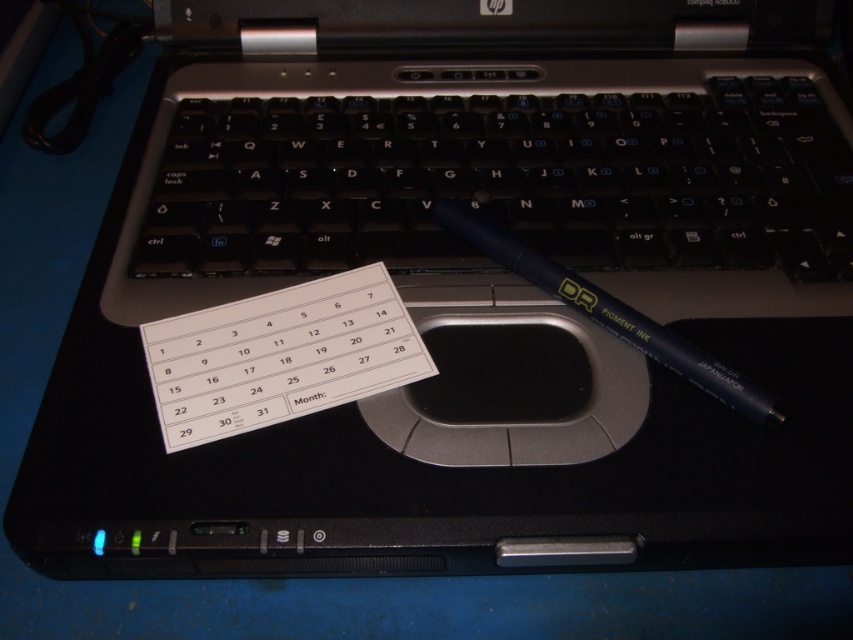
You are organizing your desk and need to place both the white paper calendar at center and the matte black pen at center. Based on their current positions, which object is closer to you?

The white paper calendar at center is closer to you because it is further to the viewer than the matte black pen at center.

You are organizing your desk and need to place the white paper calendar at center and the matte black pen at center into a drawer. The drawer has a width of 1 cm. Which object will not fit into the drawer?

The matte black pen at center is thicker than the white paper calendar at center, so it will not fit into the 1 cm wide drawer.

Consider the image. You are organizing your desk and need to place a new sticky note. The white paper calendar at center is currently on the laptop. Where should you place the sticky note to ensure it doesn not cover the calendar?

The white paper calendar at center is located at point (280, 355), so placing the sticky note elsewhere on the laptop surface away from that coordinate would prevent it from covering the calendar.